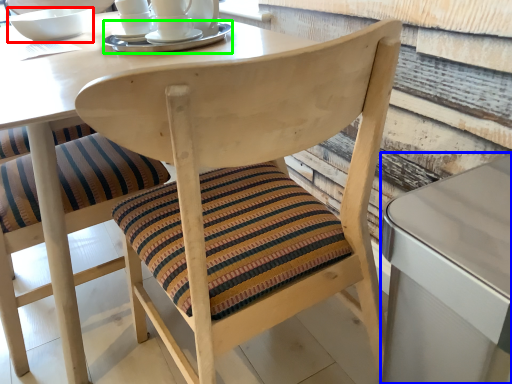
Question: Based on their relative distances, which object is farther from bowl (highlighted by a red box)? Choose from table (highlighted by a blue box) and tableware (highlighted by a green box).

Choices:
 (A) table
 (B) tableware

Answer: (A)